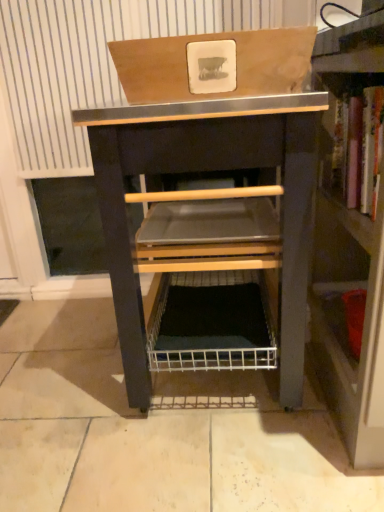
Question: Does black metal/wooden vanity at center lie in front of wooden box at upper center?

Choices:
 (A) no
 (B) yes

Answer: (A)

Question: Is black metal/wooden vanity at center smaller than wooden box at upper center?

Choices:
 (A) yes
 (B) no

Answer: (B)

Question: Can you confirm if black metal/wooden vanity at center is shorter than wooden box at upper center?

Choices:
 (A) no
 (B) yes

Answer: (A)

Question: Is black metal/wooden vanity at center wider than wooden box at upper center?

Choices:
 (A) yes
 (B) no

Answer: (A)

Question: Is wooden box at upper center a part of black metal/wooden vanity at center?

Choices:
 (A) no
 (B) yes

Answer: (A)

Question: From a real-world perspective, is black metal/wooden vanity at center physically located above or below wooden bookshelf at right?

Choices:
 (A) above
 (B) below

Answer: (B)

Question: Is black metal/wooden vanity at center in front of or behind wooden bookshelf at right in the image?

Choices:
 (A) front
 (B) behind

Answer: (B)

Question: Considering the relative positions of black metal/wooden vanity at center and wooden bookshelf at right in the image provided, is black metal/wooden vanity at center to the left or to the right of wooden bookshelf at right?

Choices:
 (A) right
 (B) left

Answer: (B)

Question: From their relative heights in the image, would you say black metal/wooden vanity at center is taller or shorter than wooden bookshelf at right?

Choices:
 (A) tall
 (B) short

Answer: (B)

Question: Looking at the image, does black metal/wooden vanity at center seem bigger or smaller compared to wooden box at upper center?

Choices:
 (A) big
 (B) small

Answer: (A)

Question: In the image, is black metal/wooden vanity at center positioned in front of or behind wooden box at upper center?

Choices:
 (A) front
 (B) behind

Answer: (B)

Question: Is point (233, 163) positioned closer to the camera than point (258, 64)?

Choices:
 (A) farther
 (B) closer

Answer: (A)

Question: From a real-world perspective, relative to wooden box at upper center, is black metal/wooden vanity at center vertically above or below?

Choices:
 (A) below
 (B) above

Answer: (A)

Question: From the image's perspective, is wooden bookshelf at right above or below wooden box at upper center?

Choices:
 (A) below
 (B) above

Answer: (A)

Question: Is point (349, 192) positioned closer to the camera than point (172, 76)?

Choices:
 (A) closer
 (B) farther

Answer: (B)